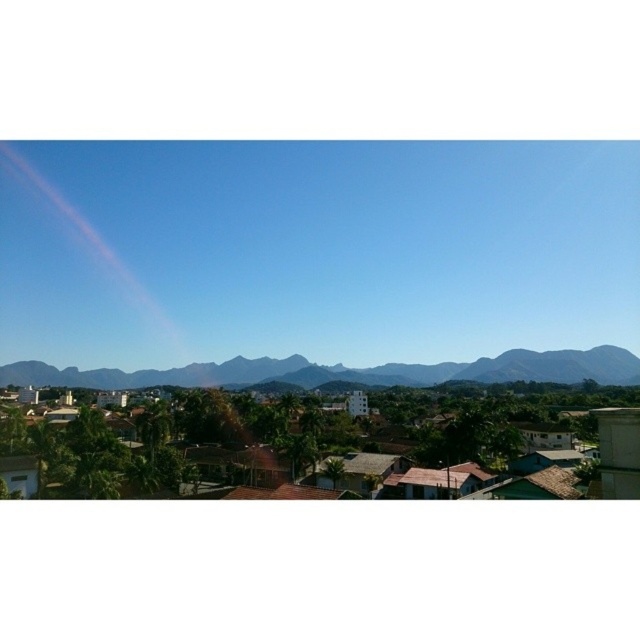
Question: Does transparent iridescent rainbow at upper left have a smaller size compared to green leafy mountains at center?

Choices:
 (A) no
 (B) yes

Answer: (A)

Question: In this image, where is transparent iridescent rainbow at upper left located relative to gray rocky mountain at center?

Choices:
 (A) above
 (B) below

Answer: (A)

Question: Which of the following is the closest to the observer?

Choices:
 (A) (20, 364)
 (B) (10, 272)
 (C) (12, 372)

Answer: (C)

Question: Which object is the closest to the transparent iridescent rainbow at upper left?

Choices:
 (A) green leafy mountains at center
 (B) gray rocky mountain at center

Answer: (A)

Question: Which is nearer to the gray rocky mountain at center?

Choices:
 (A) green leafy mountains at center
 (B) transparent iridescent rainbow at upper left

Answer: (A)

Question: Is transparent iridescent rainbow at upper left positioned at the back of gray rocky mountain at center?

Choices:
 (A) yes
 (B) no

Answer: (B)